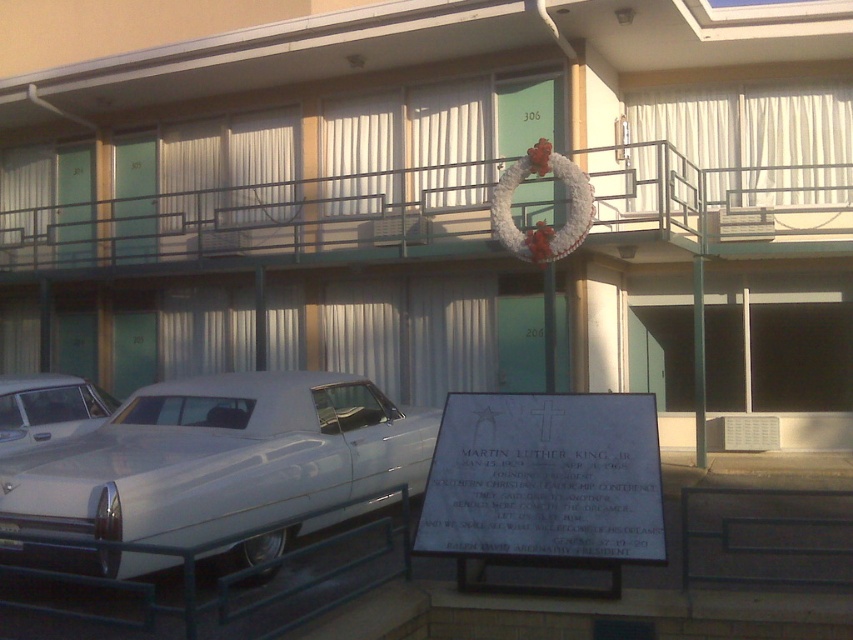
Question: Where is white glossy car at lower left located in relation to white glossy sedan at lower left in the image?

Choices:
 (A) below
 (B) above

Answer: (A)

Question: Which point is farther from the camera taking this photo?

Choices:
 (A) (700, 173)
 (B) (80, 435)
 (C) (0, 630)

Answer: (A)

Question: Which point is closer to the camera taking this photo?

Choices:
 (A) (189, 614)
 (B) (204, 236)
 (C) (39, 406)

Answer: (A)

Question: Is white glossy car at lower left positioned in front of white stone plaque at center?

Choices:
 (A) no
 (B) yes

Answer: (B)

Question: Can you confirm if metallic green balcony at upper center is positioned to the left of white glossy car at lower left?

Choices:
 (A) yes
 (B) no

Answer: (A)

Question: Estimate the real-world distances between objects in this image. Which object is closer to the metallic green balcony at upper center?

Choices:
 (A) metallic gray rail at lower left
 (B) white glossy sedan at lower left
 (C) white stone plaque at center

Answer: (B)